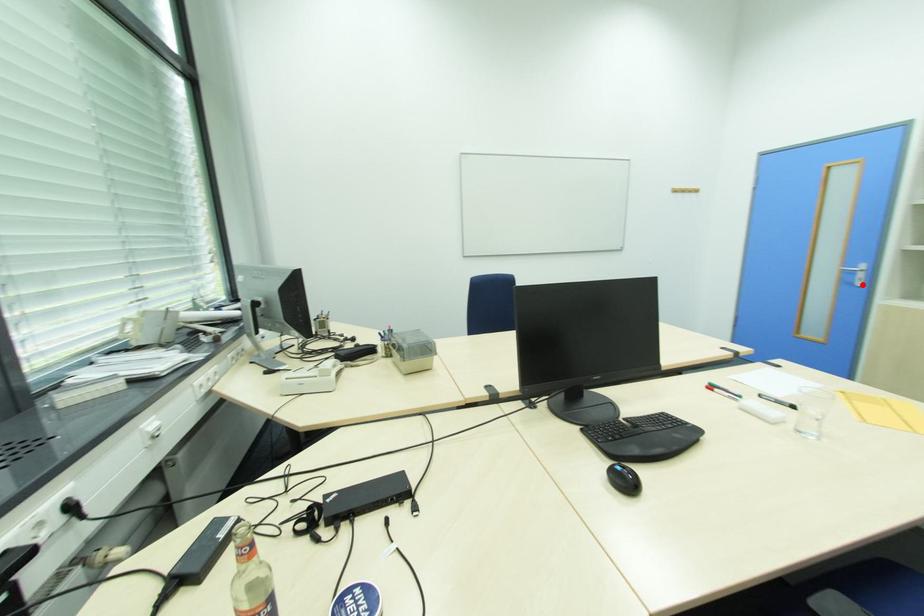
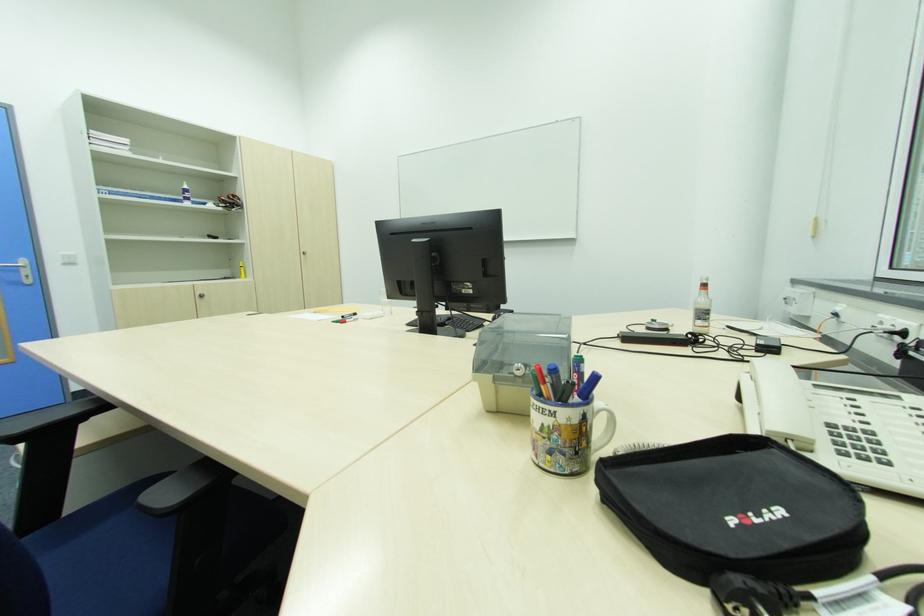
Where in the second image is the point corresponding to the highlighted location from the first image?

(30, 282)